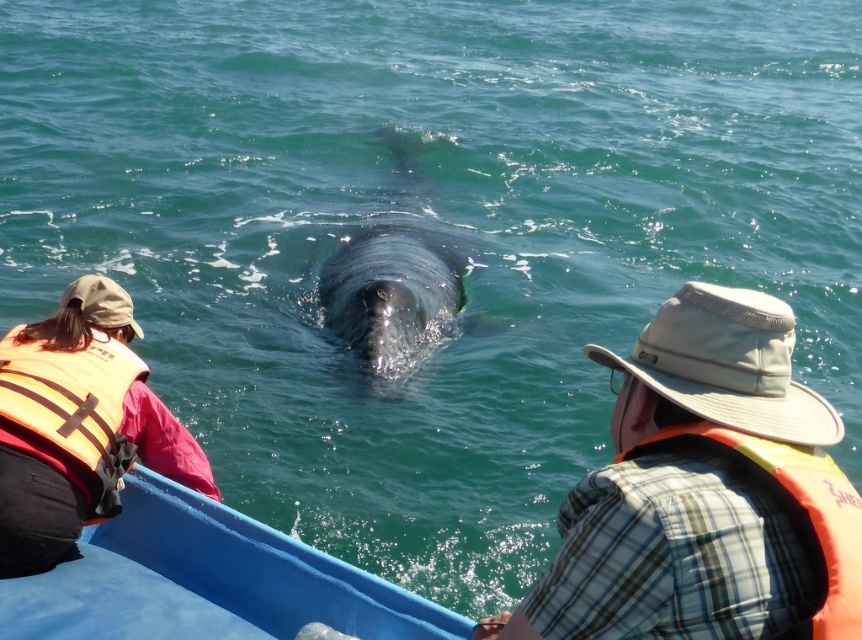
Can you confirm if blue plastic boat at center is taller than orange life vest at left?

No.

Between point (436, 627) and point (61, 454), which one is positioned in front?

Point (436, 627) is in front.

Identify the location of blue plastic boat at center. The width and height of the screenshot is (862, 640). (205, 580).

Is plaid shirt at center shorter than gray matte whale at center?

Indeed, plaid shirt at center has a lesser height compared to gray matte whale at center.

What do you see at coordinates (704, 492) in the screenshot?
I see `plaid shirt at center` at bounding box center [704, 492].

Where is `plaid shirt at center`? This screenshot has height=640, width=862. plaid shirt at center is located at coordinates (704, 492).

Is plaid shirt at center above orange life vest at left?

Yes.

Is plaid shirt at center further to the viewer compared to orange life vest at left?

No, it is not.

Measure the distance between point (744,436) and camera.

A distance of 3.87 meters exists between point (744,436) and camera.

Where is `plaid shirt at center`? The image size is (862, 640). plaid shirt at center is located at coordinates (704, 492).